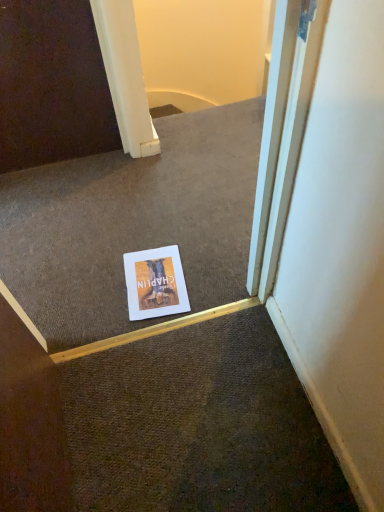
Where is `free point above white paper at center (from a real-world perspective)`? free point above white paper at center (from a real-world perspective) is located at coordinates (152, 280).